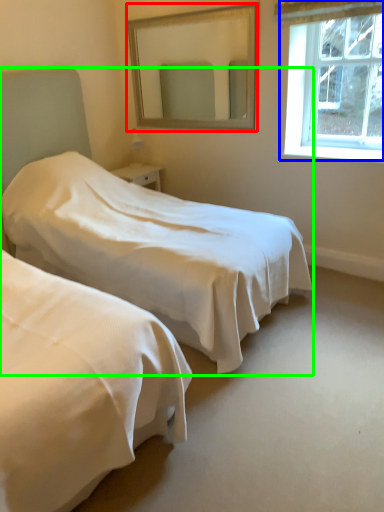
Question: Which object is the farthest from mirror (highlighted by a red box)? Choose among these: window (highlighted by a blue box) or bed (highlighted by a green box).

Choices:
 (A) window
 (B) bed

Answer: (B)